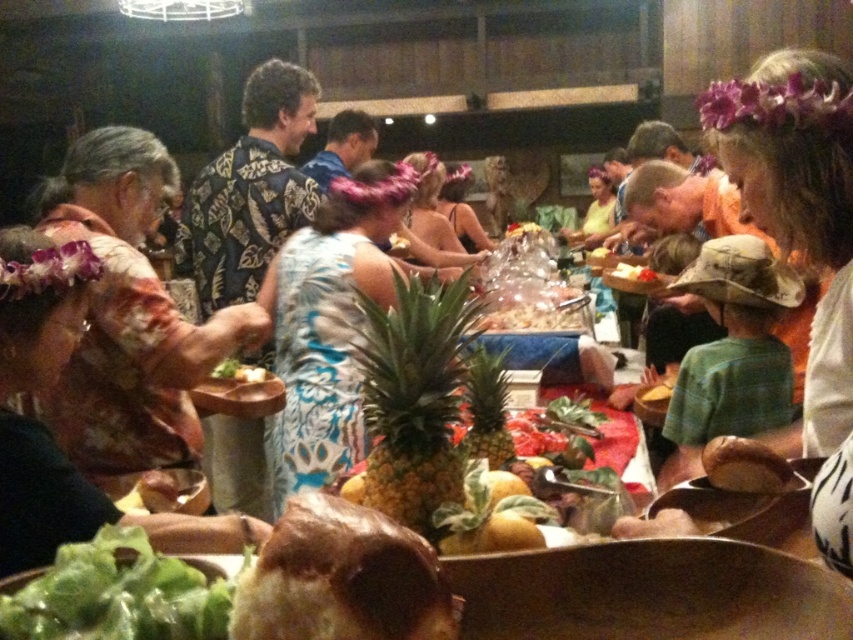
Which is in front, point (712, 440) or point (654, 390)?

Point (712, 440) is in front.

Can you confirm if golden brown bread at lower right is positioned above yellow bread at lower right?

Indeed, golden brown bread at lower right is positioned over yellow bread at lower right.

Where is `golden brown bread at lower right`? golden brown bread at lower right is located at coordinates (746, 467).

Does green leafy lettuce at lower left appear under yellow cheese at center?

Yes.

Is green leafy lettuce at lower left taller than yellow cheese at center?

Incorrect, green leafy lettuce at lower left's height is not larger of yellow cheese at center's.

Measure the distance between point (73, 602) and camera.

Point (73, 602) is 27.12 inches away from camera.

You are a GUI agent. You are given a task and a screenshot of the screen. Output one action in this format:
    pyautogui.click(x=<x>, y=<y>)
    Task: Click on the green leafy lettuce at lower left
    This screenshot has width=853, height=640.
    Given the screenshot: What is the action you would take?
    pyautogui.click(x=117, y=595)

Can you confirm if brown crispy bread at center is shorter than yellow bread at lower right?

In fact, brown crispy bread at center may be taller than yellow bread at lower right.

How far apart are brown crispy bread at center and yellow bread at lower right?

They are 1.65 meters apart.

Consider the image. Who is more distant from viewer, (436, 609) or (636, 400)?

Point (636, 400)

You are a GUI agent. You are given a task and a screenshot of the screen. Output one action in this format:
    pyautogui.click(x=<x>, y=<y>)
    Task: Click on the brown crispy bread at center
    
    Given the screenshot: What is the action you would take?
    (x=341, y=579)